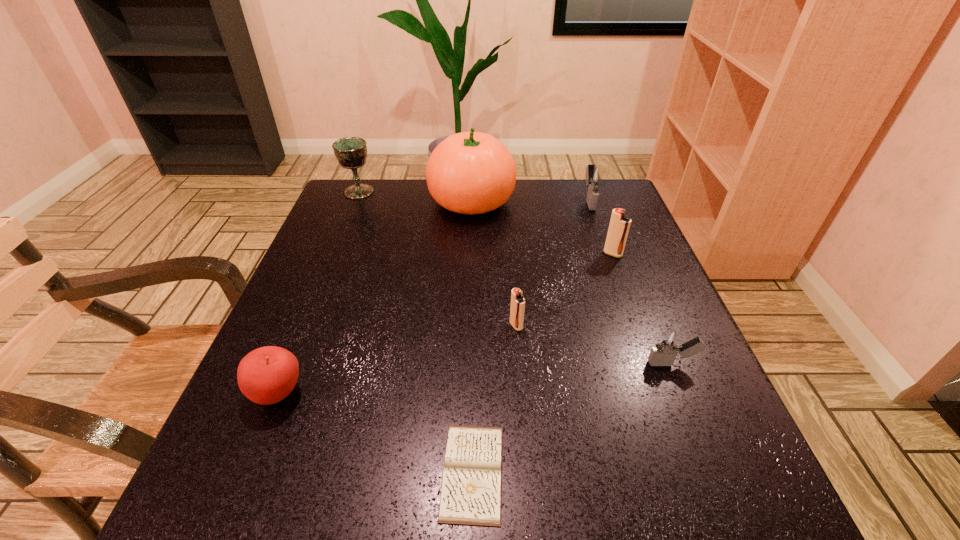
Where is `free space located on the right of the diary`? Image resolution: width=960 pixels, height=540 pixels. free space located on the right of the diary is located at coordinates (641, 472).

The width and height of the screenshot is (960, 540). I want to click on pumpkin situated at the far edge, so click(x=471, y=172).

At what (x,y) coordinates should I click in order to perform the action: click on chalice present at the far edge. Please return your answer as a coordinate pair (x, y). Looking at the image, I should click on (351, 152).

At what (x,y) coordinates should I click in order to perform the action: click on igniter that is positioned at the far edge. Please return your answer as a coordinate pair (x, y). The image size is (960, 540). Looking at the image, I should click on (596, 176).

Where is `object that is at the near edge`? This screenshot has width=960, height=540. object that is at the near edge is located at coordinates (471, 491).

Where is `chalice at the left edge`? chalice at the left edge is located at coordinates (351, 152).

I want to click on apple that is at the left edge, so click(x=266, y=375).

Where is `object located in the far left corner section of the desktop`? Image resolution: width=960 pixels, height=540 pixels. object located in the far left corner section of the desktop is located at coordinates (351, 152).

I want to click on object located in the far right corner section of the desktop, so click(x=596, y=176).

The height and width of the screenshot is (540, 960). What are the coordinates of `free space at the far edge of the desktop` in the screenshot? It's located at (489, 214).